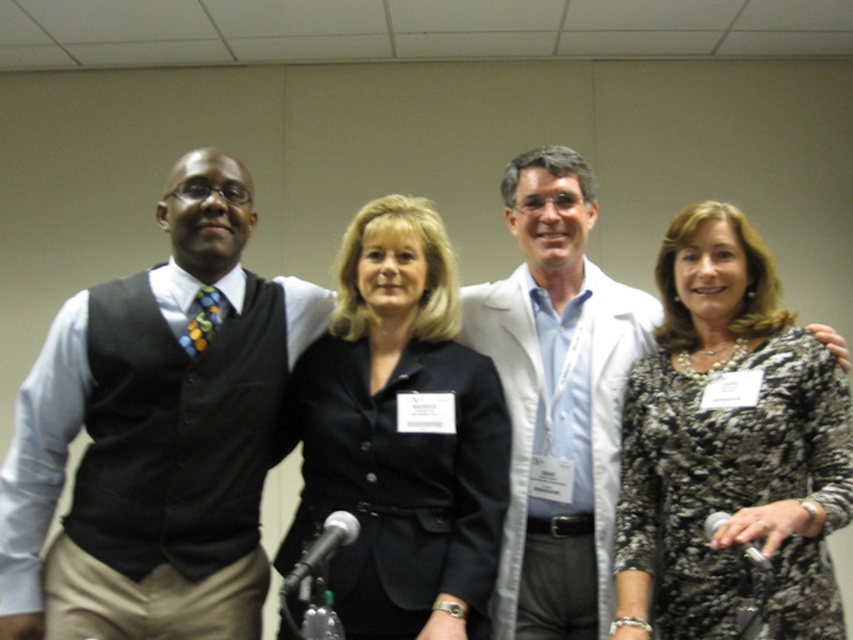
Question: Which is nearer to the matte black vest at left?

Choices:
 (A) black textured dress at center
 (B) white lab coat at center

Answer: (B)

Question: Among these objects, which one is farthest from the camera?

Choices:
 (A) white lab coat at center
 (B) black smooth blazer at center

Answer: (A)

Question: Observing the image, what is the correct spatial positioning of matte black vest at left in reference to black smooth blazer at center?

Choices:
 (A) right
 (B) left

Answer: (B)

Question: Estimate the real-world distances between objects in this image. Which object is closer to the matte black vest at left?

Choices:
 (A) black textured dress at center
 (B) black smooth blazer at center

Answer: (B)

Question: Can you confirm if black textured dress at center is positioned above black smooth blazer at center?

Choices:
 (A) yes
 (B) no

Answer: (A)

Question: Is matte black vest at left bigger than white lab coat at center?

Choices:
 (A) yes
 (B) no

Answer: (A)